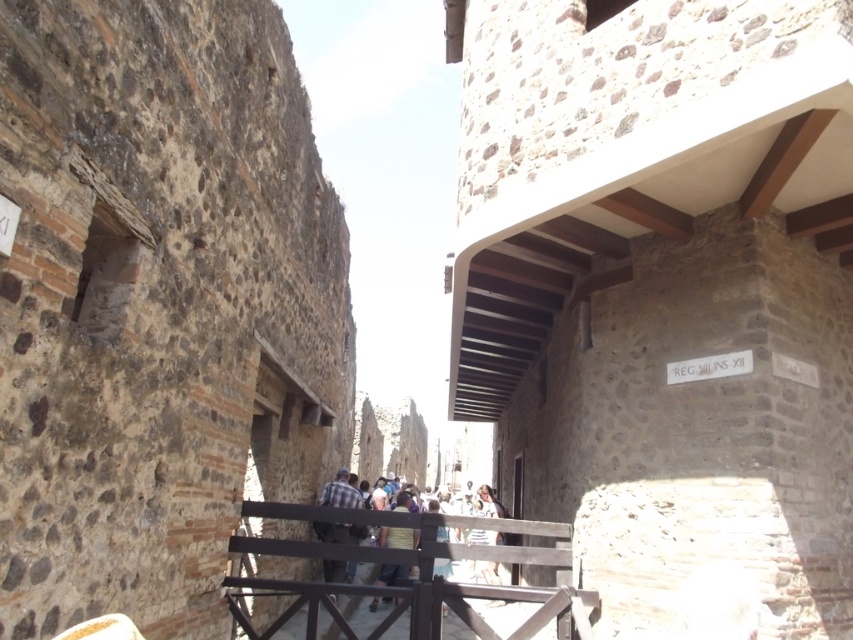
Question: Is black wood rail at center to the right of plaid shirt at center from the viewer's perspective?

Choices:
 (A) no
 (B) yes

Answer: (B)

Question: Which object appears closest to the camera in this image?

Choices:
 (A) plaid shirt at center
 (B) black wood rail at center

Answer: (B)

Question: Observing the image, what is the correct spatial positioning of black wood rail at center in reference to plaid shirt at center?

Choices:
 (A) below
 (B) above

Answer: (B)

Question: Can you confirm if black wood rail at center is positioned to the left of plaid shirt at center?

Choices:
 (A) no
 (B) yes

Answer: (A)